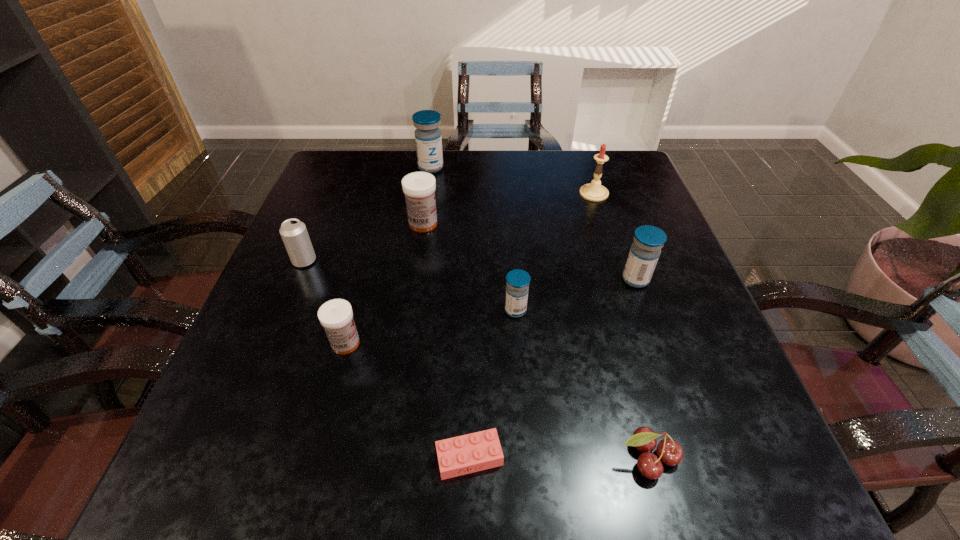
Where is `the fourth farthest medicine`? The width and height of the screenshot is (960, 540). the fourth farthest medicine is located at coordinates (517, 288).

The width and height of the screenshot is (960, 540). In order to click on the second medicine from right to left in this screenshot , I will do point(517,288).

In order to click on the left white medicine in this screenshot , I will do point(336,316).

Locate an element on the screen. This screenshot has height=540, width=960. the eighth object from right to left is located at coordinates pyautogui.click(x=336, y=316).

Identify the location of the eighth tallest object. The width and height of the screenshot is (960, 540). coord(669,451).

Where is `cherry`? This screenshot has height=540, width=960. cherry is located at coordinates (669, 451).

Identify the location of Lego. This screenshot has width=960, height=540. (478, 451).

I want to click on the shortest object, so click(478, 451).

Identify the location of free space located 0.160m on the right of the farthest medicine. (501, 167).

You are a GUI agent. You are given a task and a screenshot of the screen. Output one action in this format:
    pyautogui.click(x=<x>, y=<y>)
    Task: Click on the blank area located on the left of the red candle
    This screenshot has height=540, width=960.
    Given the screenshot: What is the action you would take?
    pyautogui.click(x=491, y=193)